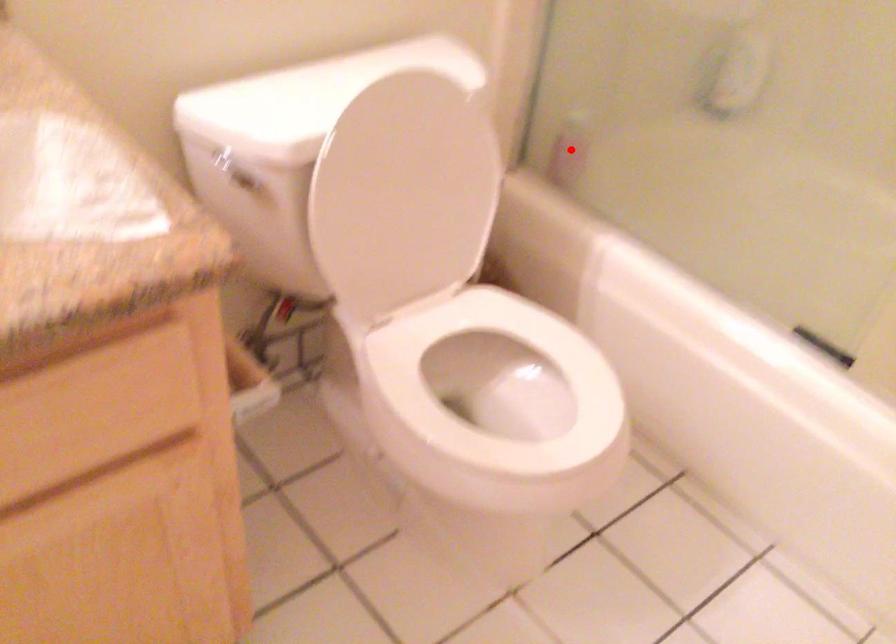
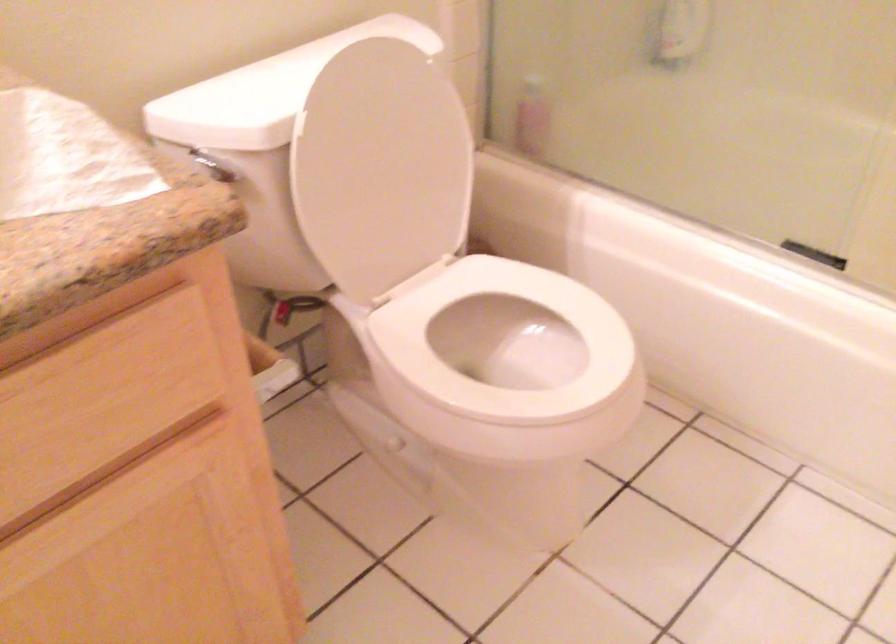
Where in the second image is the point corresponding to the highlighted location from the first image?

(533, 117)